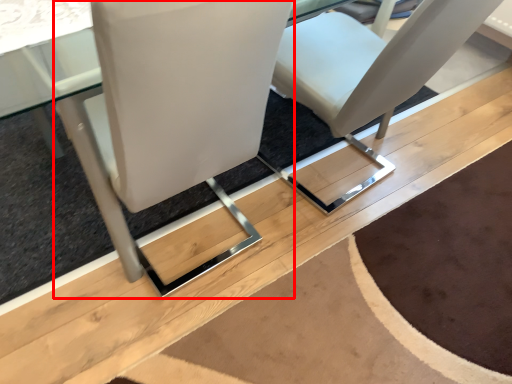
Question: From the image's perspective, considering the relative positions of chair (annotated by the red box) and chair in the image provided, where is chair (annotated by the red box) located with respect to the staircase?

Choices:
 (A) below
 (B) above

Answer: (A)